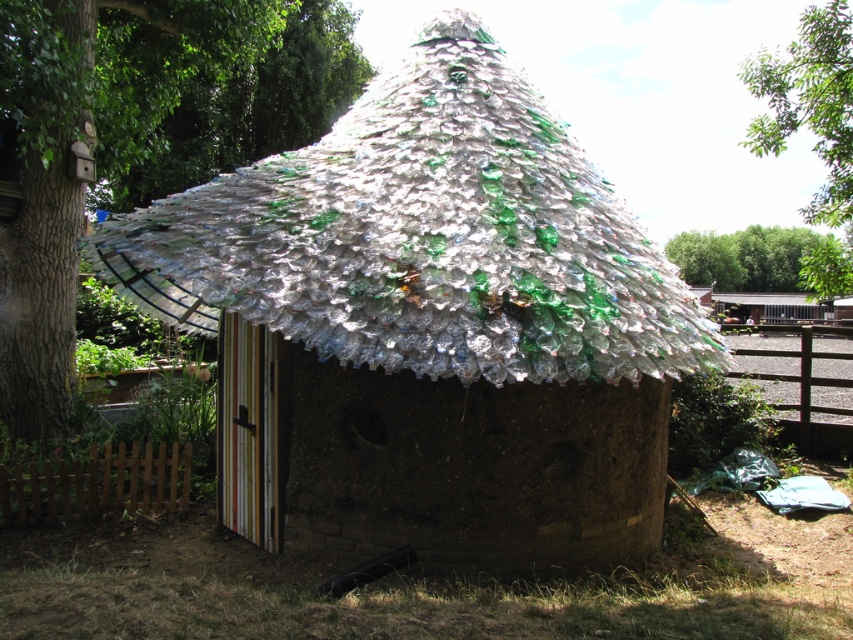
Question: Can you confirm if translucent plastic bottles at center is positioned below translucent plastic bottles at upper center?

Choices:
 (A) yes
 (B) no

Answer: (B)

Question: Does translucent plastic umbrella at center appear on the right side of green leafy tree at upper right?

Choices:
 (A) no
 (B) yes

Answer: (A)

Question: Which of the following is the closest to the observer?

Choices:
 (A) (762, 83)
 (B) (468, 340)

Answer: (B)

Question: Is translucent plastic bottles at center to the left of translucent plastic bottles at upper center from the viewer's perspective?

Choices:
 (A) no
 (B) yes

Answer: (A)

Question: Which object appears farthest from the camera in this image?

Choices:
 (A) translucent plastic umbrella at center
 (B) green glass tree at upper center
 (C) translucent plastic bottles at center
 (D) green leafy tree at upper right

Answer: (B)

Question: Which of the following is the farthest from the observer?

Choices:
 (A) (489, 44)
 (B) (294, 29)

Answer: (B)